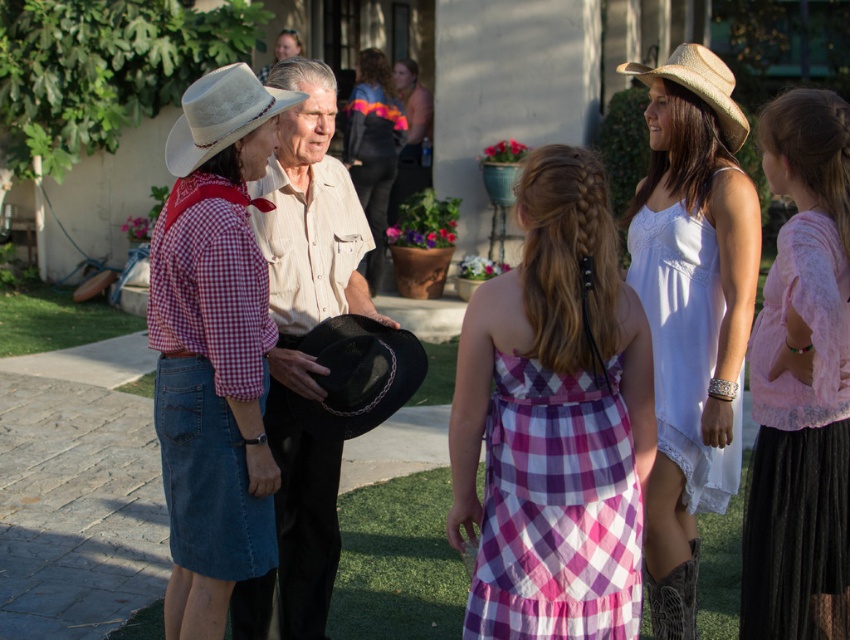
Is denim skirt at left taller than white woven cowboy hat at center?

Yes, denim skirt at left is taller than white woven cowboy hat at center.

What are the coordinates of `denim skirt at left` in the screenshot? It's located at (214, 348).

Which is behind, point (360, 364) or point (403, 112)?

The point (403, 112) is more distant.

Who is more forward, (340, 328) or (417, 145)?

Positioned in front is point (340, 328).

Where is `black felt cowboy hat at center`? The image size is (850, 640). black felt cowboy hat at center is located at coordinates [x=357, y=376].

Between pink lace blouse at center and white lace dress at center, which one appears on the left side from the viewer's perspective?

white lace dress at center

Does pink lace blouse at center have a larger size compared to white lace dress at center?

Yes.

I want to click on pink lace blouse at center, so click(802, 384).

Locate an element on the screen. pink lace blouse at center is located at coordinates (802, 384).